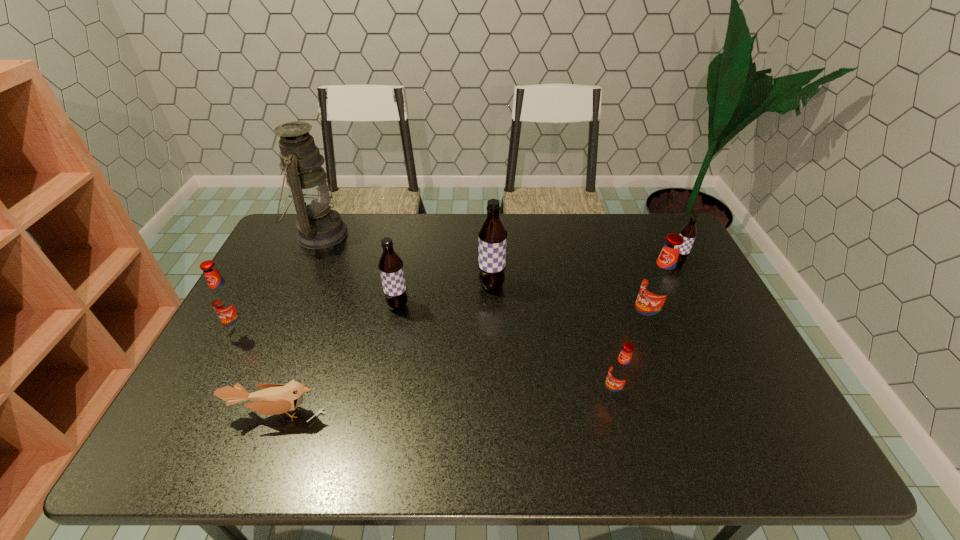
Find the location of a particular element. The image size is (960, 540). oil lamp is located at coordinates (319, 227).

You are a GUI agent. You are given a task and a screenshot of the screen. Output one action in this format:
    pyautogui.click(x=<x>, y=<y>)
    Task: Click on the third farthest object
    
    Given the screenshot: What is the action you would take?
    pyautogui.click(x=492, y=236)

Identify the location of the biggest brown root beer. (492, 236).

Image resolution: width=960 pixels, height=540 pixels. In order to click on the biggest red root beer in this screenshot , I will do `click(659, 283)`.

Locate an element on the screen. This screenshot has height=540, width=960. the second root beer from right to left is located at coordinates (659, 283).

The image size is (960, 540). Identify the location of the fifth object from right to left. pyautogui.click(x=390, y=265).

The image size is (960, 540). What are the coordinates of `the leftmost brown root beer` in the screenshot? It's located at (390, 265).

Locate an element on the screen. the leftmost root beer is located at coordinates (225, 300).

Find the location of a particular element. the leftmost red root beer is located at coordinates (225, 300).

Locate an element on the screen. The width and height of the screenshot is (960, 540). the smallest red root beer is located at coordinates (620, 371).